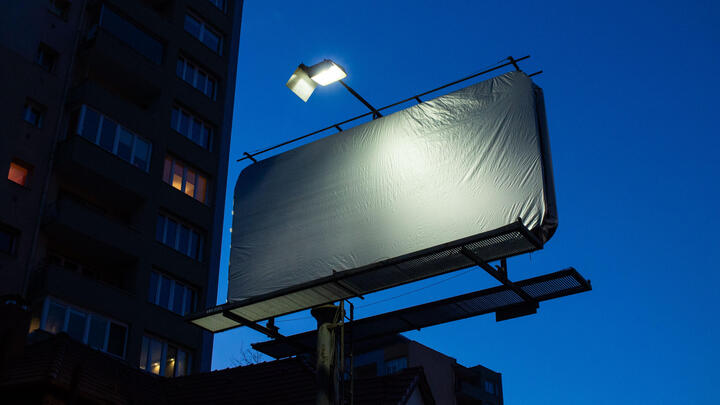
Identify the location of light in window. (184, 187), (166, 361), (14, 172), (40, 328).